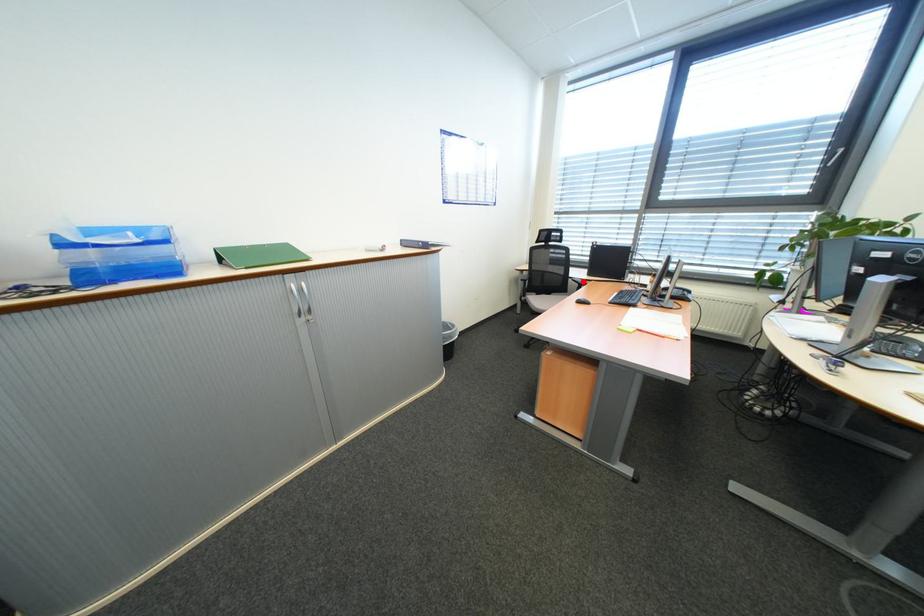
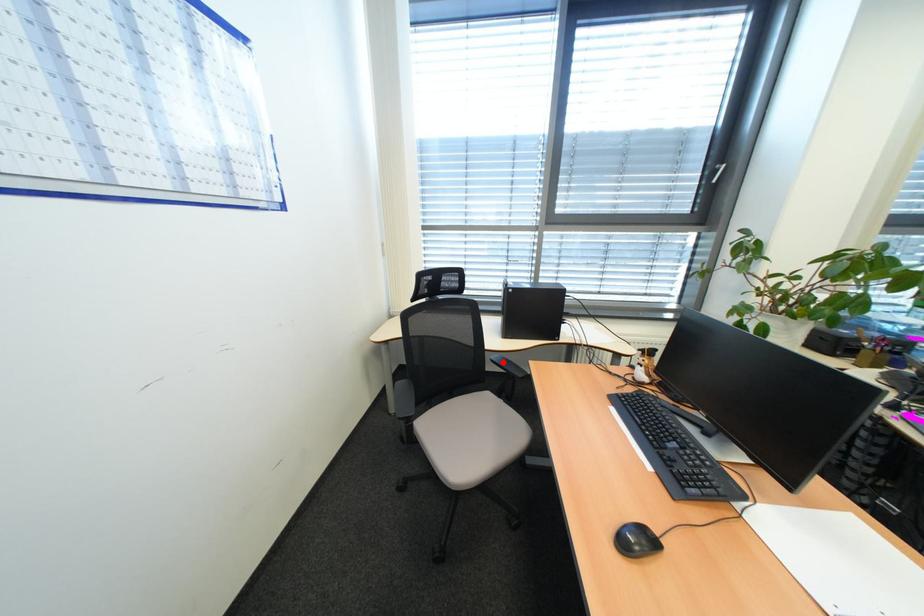
I am providing you with two images of the same scene from different viewpoints. A red point is marked on the first image and another point is marked on the second image. Does the point marked in image1 correspond to the same location as the one in image2?

Yes